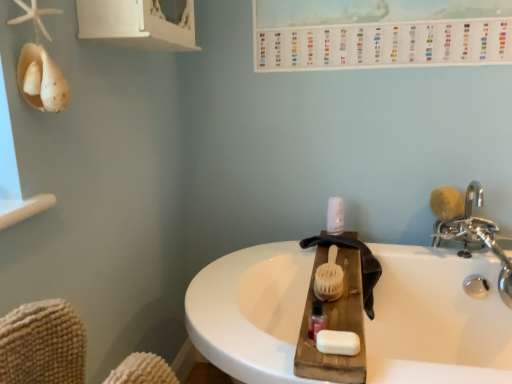
Find the location of a particular element. The image size is (512, 384). free spot behind white matte soap at center is located at coordinates (337, 308).